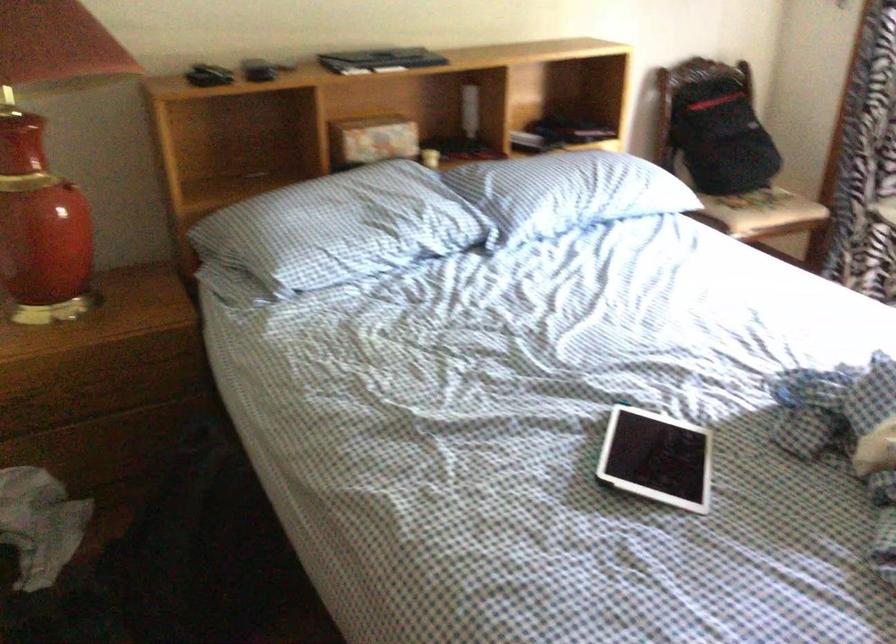
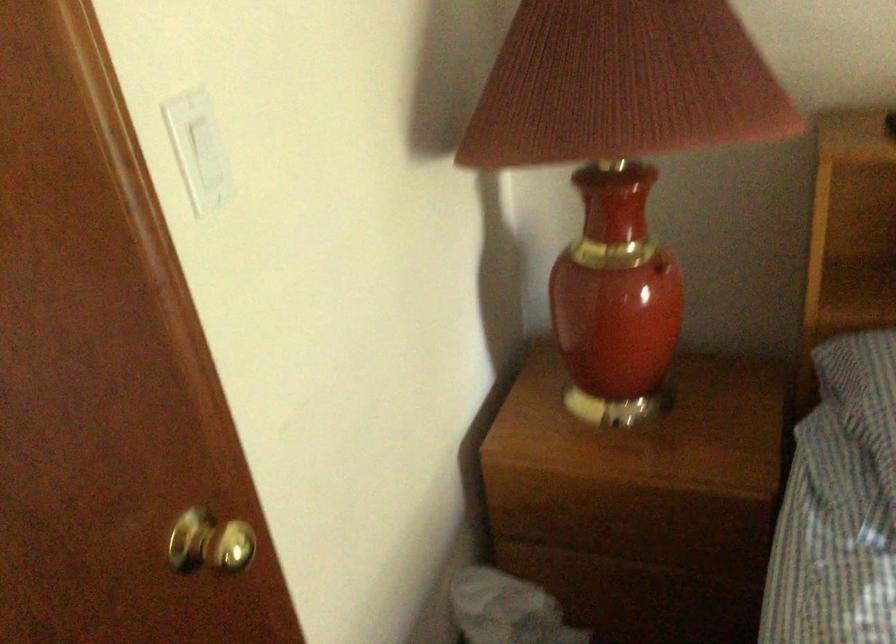
Question: The camera is either moving clockwise (left) or counter-clockwise (right) around the object. The first image is from the beginning of the video and the second image is from the end. Is the camera moving left or right when shooting the video?

Choices:
 (A) Left
 (B) Right

Answer: (B)